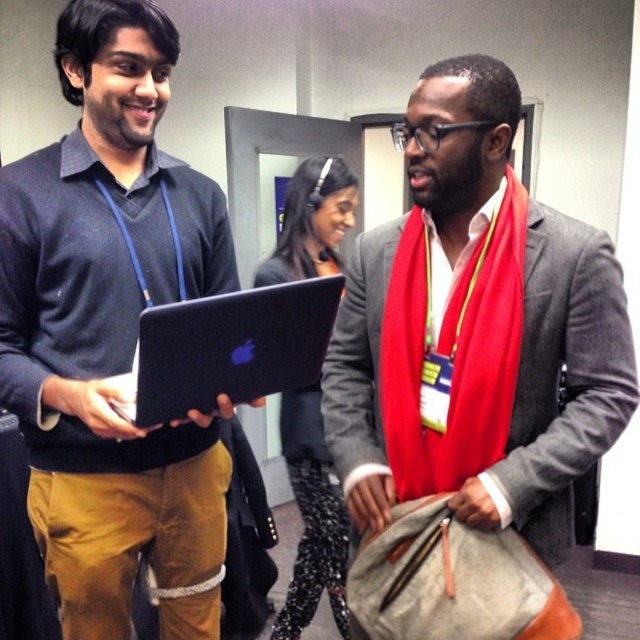
In the scene shown: Is matte black laptop at center above black glossy laptop at center?

Indeed, matte black laptop at center is positioned over black glossy laptop at center.

This screenshot has width=640, height=640. I want to click on matte black laptop at center, so click(x=113, y=333).

Where is `matte black laptop at center`? This screenshot has width=640, height=640. matte black laptop at center is located at coordinates (113, 333).

Which of these two, matte gray blazer at center or black matte laptop at center, stands shorter?

black matte laptop at center

Does point (424, 454) come closer to viewer compared to point (269, 342)?

No, (424, 454) is further to viewer.

Locate an element on the screen. matte gray blazer at center is located at coordinates (476, 330).

Between matte gray blazer at center and black glossy laptop at center, which one appears on the right side from the viewer's perspective?

matte gray blazer at center

Who is more distant from viewer, (x=512, y=291) or (x=332, y=580)?

Positioned behind is point (x=332, y=580).

This screenshot has width=640, height=640. Find the location of `matte gray blazer at center`. matte gray blazer at center is located at coordinates (476, 330).